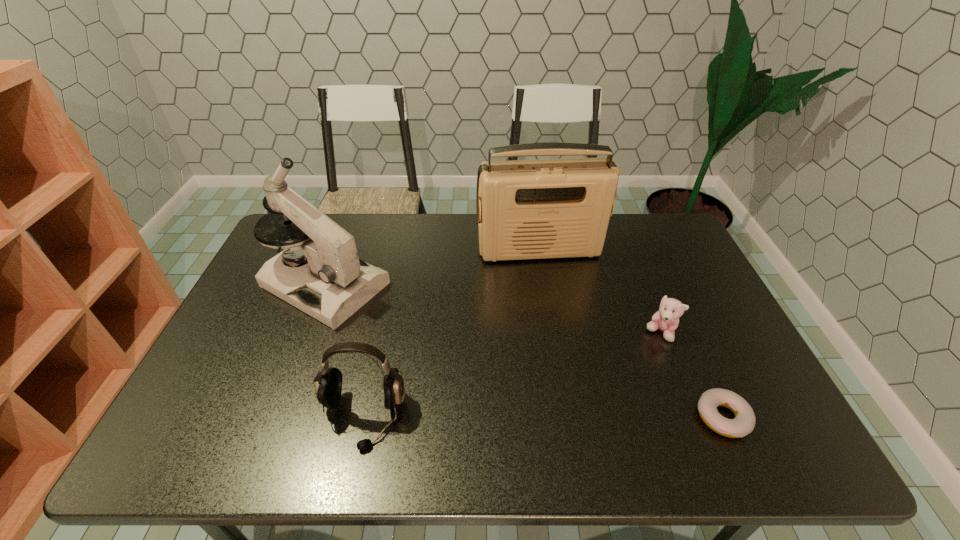
The width and height of the screenshot is (960, 540). What are the coordinates of `object positioned at the right edge` in the screenshot? It's located at (744, 422).

You are a GUI agent. You are given a task and a screenshot of the screen. Output one action in this format:
    pyautogui.click(x=<x>, y=<y>)
    Task: Click on the object located in the far left corner section of the desktop
    The image size is (960, 540).
    Given the screenshot: What is the action you would take?
    pyautogui.click(x=335, y=283)

Locate an element on the screen. object that is at the near right corner is located at coordinates (744, 422).

Identify the location of free space at the far edge. This screenshot has height=540, width=960. pyautogui.click(x=461, y=235).

This screenshot has height=540, width=960. What are the coordinates of `vacant position at the near edge of the desktop` in the screenshot? It's located at (413, 414).

Identify the location of free space at the right edge of the desktop. This screenshot has width=960, height=540. (660, 299).

Find the location of a particular element. vacant space that's between the microscope and the third object from right to left is located at coordinates (432, 268).

What are the coordinates of `free space that is in between the third shortest object and the teddy bear` in the screenshot? It's located at [512, 375].

Where is `unoccupied area between the second shortest object and the shortest object`? The height and width of the screenshot is (540, 960). unoccupied area between the second shortest object and the shortest object is located at coordinates (691, 375).

Find the location of `free space that is in between the microscope and the second shortest object`. free space that is in between the microscope and the second shortest object is located at coordinates (492, 309).